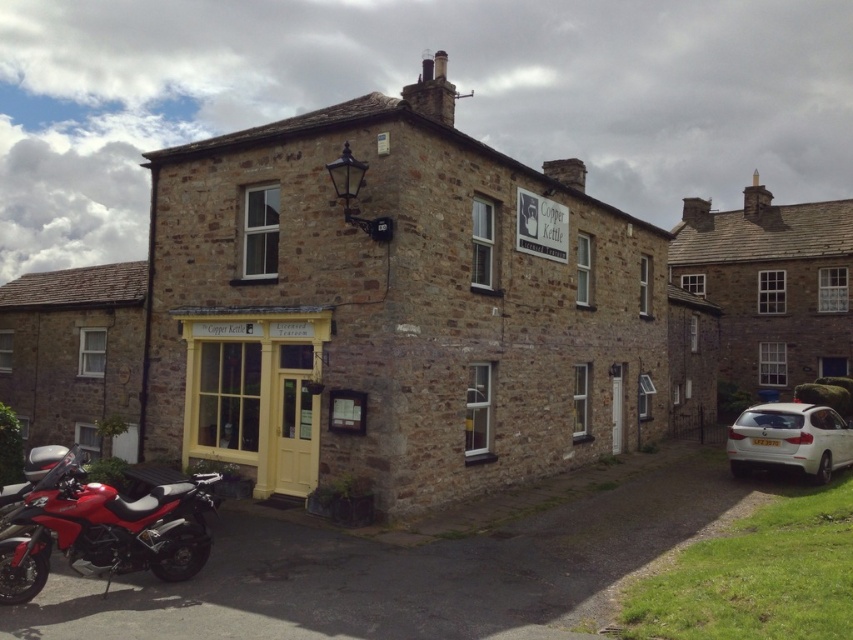
You are a delivery person needing to park your 2.5 meter wide delivery van between the shiny red motorcycle at lower left and the white matte car at lower right. Can you fit your van there?

The distance between the shiny red motorcycle at lower left and the white matte car at lower right is 12.32 meters. Since your van is 2.5 meters wide, there is sufficient space to park it between them.

You are a delivery person needing to park your vehicle between the shiny red motorcycle at lower left and the white matte car at lower right. Based on their sizes, which vehicle should you park closer to if you want to maximize the remaining space?

The shiny red motorcycle at lower left is shorter than the white matte car at lower right, so you should park closer to the shiny red motorcycle at lower left to maximize the remaining space between them.

You are a delivery person who needs to park your vehicle in front of the Copper Kettle Tearoom. You have a delivery van that is 2 meters wide. There is space between the shiny red motorcycle at lower left and the white matte car at lower right. Can your van fit in that space?

The shiny red motorcycle at lower left has a lesser width compared to white matte car at lower right. Since the motorcycle is narrower, the space between them might be insufficient for a 2m wide van. However, without knowing the exact distance between the vehicles, it is impossible to confirm if the van will fit.